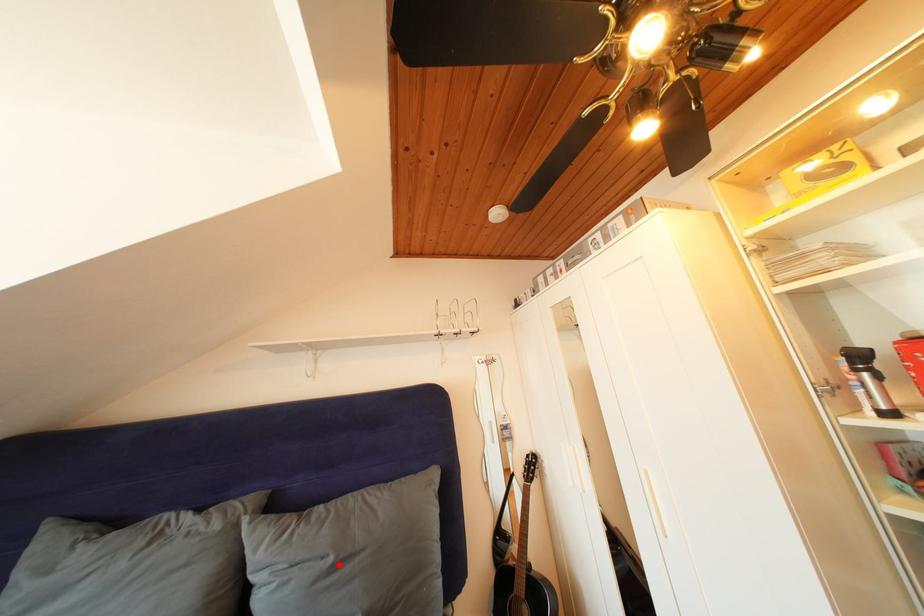
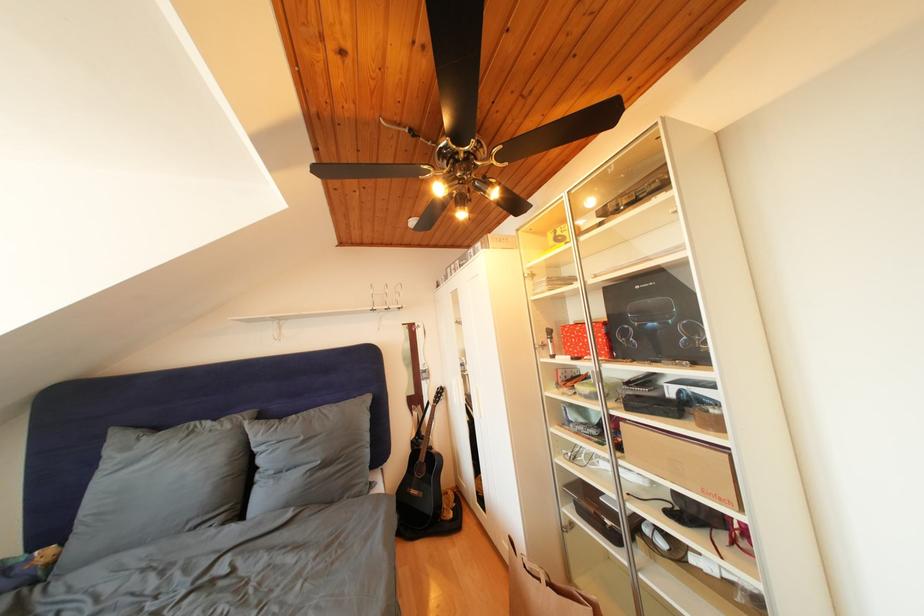
The point at the highlighted location is marked in the first image. Where is the corresponding point in the second image?

(310, 444)